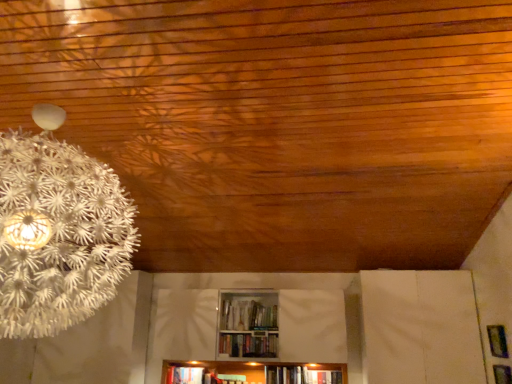
Describe the element at coordinates (185, 375) in the screenshot. I see `hardcover book at lower center, the second book from the right` at that location.

Describe the element at coordinates (248, 345) in the screenshot. The height and width of the screenshot is (384, 512). I see `hardcover book at center, positioned as the 1th book in front-to-back order` at that location.

Identify the location of metallic silver frame at lower right. 497,341.

Is metallic silver frame at lower right taller or shorter than hardcover book at center, the second book positioned from the left?

Clearly, metallic silver frame at lower right is taller compared to hardcover book at center, the second book positioned from the left.

Consider the image. From the image's perspective, does metallic silver frame at lower right appear lower than hardcover book at center, the 1th book from the top?

Incorrect, from the image's perspective, metallic silver frame at lower right is higher than hardcover book at center, the 1th book from the top.

In order to click on the 1st book below when counting from the metallic silver frame at lower right (from the image's perspective) in this screenshot , I will do click(x=248, y=345).

Which object is positioned more to the right, metallic silver frame at lower right or hardcover book at center, marked as the 1th book in a right-to-left arrangement?

From the viewer's perspective, metallic silver frame at lower right appears more on the right side.

Does point (169, 369) lie in front of point (506, 338)?

No, it is behind (506, 338).

From the image's perspective, does hardcover book at lower center, marked as the 2th book in a front-to-back arrangement, appear higher than metallic silver frame at lower right?

No, from the image's perspective, hardcover book at lower center, marked as the 2th book in a front-to-back arrangement, is not above metallic silver frame at lower right.

Which object is further away from the camera taking this photo, hardcover book at lower center, the 1th book from the back, or metallic silver frame at lower right?

Result: hardcover book at lower center, the 1th book from the back, is behind.

Is hardcover book at lower center, which is the second book in top-to-bottom order, wider than metallic silver frame at lower right?

Yes, hardcover book at lower center, which is the second book in top-to-bottom order, is wider than metallic silver frame at lower right.

How distant is hardcover book at center, the second book positioned from the left, from metallic silver frame at lower right?

A distance of 2.00 meters exists between hardcover book at center, the second book positioned from the left, and metallic silver frame at lower right.

What's the angular difference between hardcover book at center, the 1th book from the top, and metallic silver frame at lower right's facing directions?

They differ by 90.1 degrees in their facing directions.

From the image's perspective, is hardcover book at center, positioned as the 1th book in front-to-back order, above metallic silver frame at lower right?

No, from the image's perspective, hardcover book at center, positioned as the 1th book in front-to-back order, is not on top of metallic silver frame at lower right.

In the scene shown: Is the depth of hardcover book at center, the 1th book from the top, less than that of metallic silver frame at lower right?

No, hardcover book at center, the 1th book from the top, is further to the viewer.

Starting from the metallic silver frame at lower right, which book is the 2nd one behind? Please provide its 2D coordinates.

[(185, 375)]

Are metallic silver frame at lower right and hardcover book at lower center, the second book from the right, beside each other?

There is a gap between metallic silver frame at lower right and hardcover book at lower center, the second book from the right.

Is metallic silver frame at lower right oriented towards hardcover book at lower center, marked as the 2th book in a front-to-back arrangement?

Yes, metallic silver frame at lower right is oriented towards hardcover book at lower center, marked as the 2th book in a front-to-back arrangement.

Is hardcover book at lower center, the second book from the right, oriented away from hardcover book at center, marked as the 1th book in a right-to-left arrangement?

No, hardcover book at lower center, the second book from the right, is not facing away from hardcover book at center, marked as the 1th book in a right-to-left arrangement.

The image size is (512, 384). Identify the location of book above the hardcover book at lower center, the second book from the right (from a real-world perspective). (248, 345).

How distant is hardcover book at lower center, marked as the 2th book in a front-to-back arrangement, from hardcover book at center, positioned as the second book in back-to-front order?

26.41 inches.

Is hardcover book at lower center, placed as the 1th book when sorted from bottom to top, inside or outside of hardcover book at center, positioned as the second book in back-to-front order?

hardcover book at lower center, placed as the 1th book when sorted from bottom to top, cannot be found inside hardcover book at center, positioned as the second book in back-to-front order.

From the image's perspective, which is above, hardcover book at center, the 1th book from the top, or hardcover book at lower center, marked as the 2th book in a front-to-back arrangement?

hardcover book at center, the 1th book from the top, from the image's perspective.

From a real-world perspective, is hardcover book at center, positioned as the 1th book in front-to-back order, physically located above or below hardcover book at lower center, the 1th book when ordered from left to right?

Clearly, from a real-world perspective, hardcover book at center, positioned as the 1th book in front-to-back order, is above hardcover book at lower center, the 1th book when ordered from left to right.

In the scene shown: Can you tell me how much hardcover book at center, positioned as the second book in back-to-front order, and hardcover book at lower center, which is the second book in top-to-bottom order, differ in facing direction?

The facing directions of hardcover book at center, positioned as the second book in back-to-front order, and hardcover book at lower center, which is the second book in top-to-bottom order, are 0.00325 degrees apart.

Where is `the 1st book below the metallic silver frame at lower right (from a real-world perspective)`? the 1st book below the metallic silver frame at lower right (from a real-world perspective) is located at coordinates (248, 345).

Where is `panel that appears above the hardcover book at lower center, placed as the 1th book when sorted from bottom to top (from the image's perspective)`? panel that appears above the hardcover book at lower center, placed as the 1th book when sorted from bottom to top (from the image's perspective) is located at coordinates (497, 341).

Based on their spatial positions, is hardcover book at lower center, the 1th book from the back, or hardcover book at center, the second book positioned from the left, closer to metallic silver frame at lower right?

hardcover book at center, the second book positioned from the left, lies closer to metallic silver frame at lower right than the other object.

Looking at the image, which one is located further to hardcover book at lower center, placed as the 1th book when sorted from bottom to top, metallic silver frame at lower right or hardcover book at center, the 1th book from the top?

metallic silver frame at lower right.

Estimate the real-world distances between objects in this image. Which object is closer to hardcover book at lower center, placed as the 1th book when sorted from bottom to top, hardcover book at center, marked as the 1th book in a right-to-left arrangement, or metallic silver frame at lower right?

hardcover book at center, marked as the 1th book in a right-to-left arrangement, is closer to hardcover book at lower center, placed as the 1th book when sorted from bottom to top.

Based on their spatial positions, is hardcover book at lower center, the 1th book when ordered from left to right, or metallic silver frame at lower right closer to hardcover book at center, the 1th book from the top?

hardcover book at lower center, the 1th book when ordered from left to right, is closer to hardcover book at center, the 1th book from the top.

From the image, which object appears to be nearer to metallic silver frame at lower right, hardcover book at center, arranged as the 2th book when ordered from the bottom, or hardcover book at lower center, marked as the 2th book in a front-to-back arrangement?

hardcover book at center, arranged as the 2th book when ordered from the bottom, lies closer to metallic silver frame at lower right than the other object.

Considering their positions, is metallic silver frame at lower right positioned further to hardcover book at center, marked as the 1th book in a right-to-left arrangement, than hardcover book at lower center, the 1th book from the back?

metallic silver frame at lower right is further to hardcover book at center, marked as the 1th book in a right-to-left arrangement.

Find the location of `book between hardcover book at lower center, the second book from the right, and metallic silver frame at lower right from left to right`. book between hardcover book at lower center, the second book from the right, and metallic silver frame at lower right from left to right is located at coordinates (248, 345).